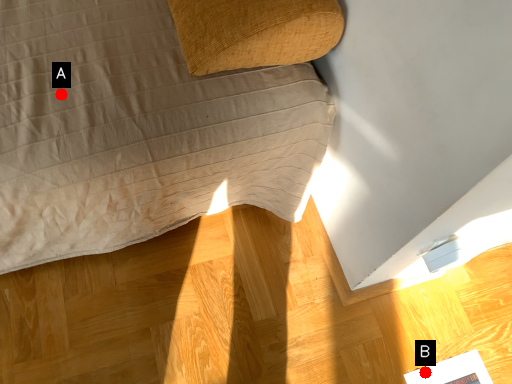
Question: Two points are circled on the image, labeled by A and B beside each circle. Which point is farther to the camera?

Choices:
 (A) A is further
 (B) B is further

Answer: (B)